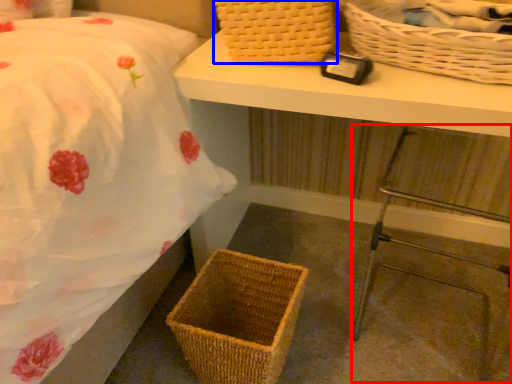
Question: Which object appears farthest to the camera in this image, step stool (highlighted by a red box) or picnic basket (highlighted by a blue box)?

Choices:
 (A) step stool
 (B) picnic basket

Answer: (B)